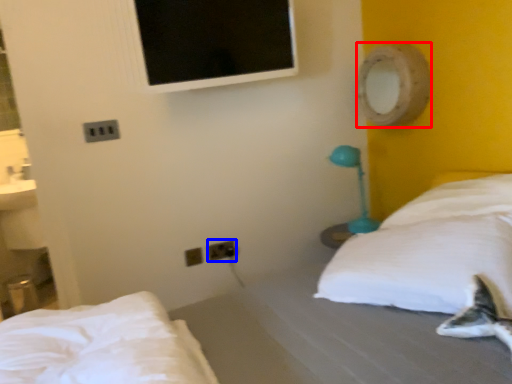
Question: Which point is closer to the camera, mirror (highlighted by a red box) or electric outlet (highlighted by a blue box)?

Choices:
 (A) mirror
 (B) electric outlet

Answer: (A)